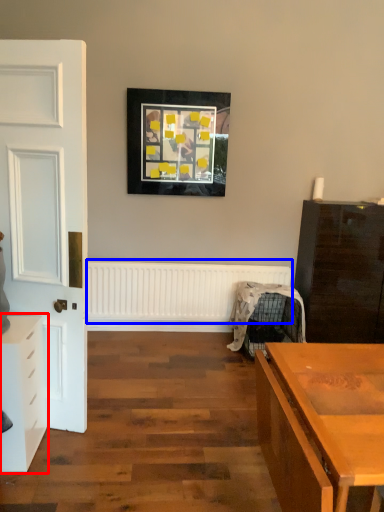
Question: Which of the following is the closest to the observer, chest of drawers (highlighted by a red box) or radiator (highlighted by a blue box)?

Choices:
 (A) chest of drawers
 (B) radiator

Answer: (A)